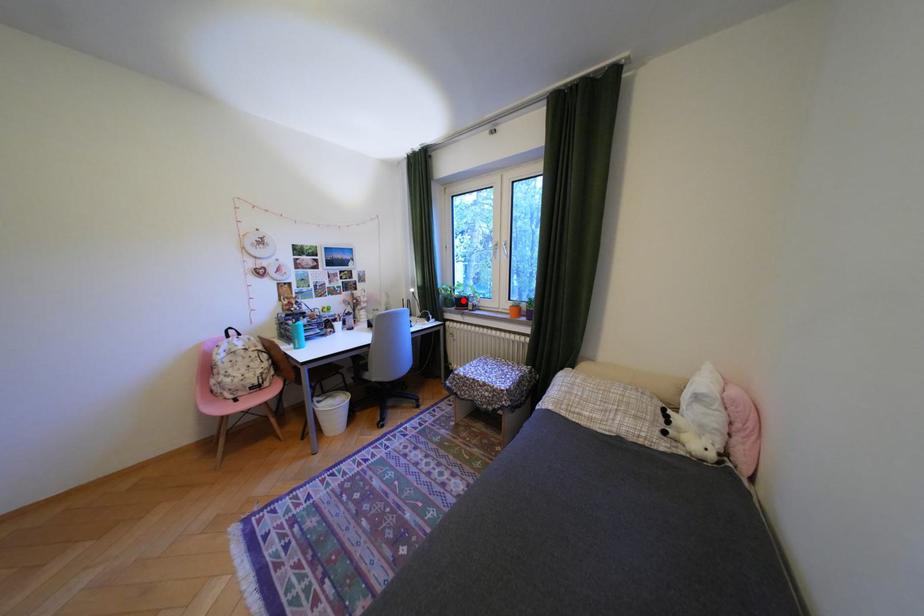
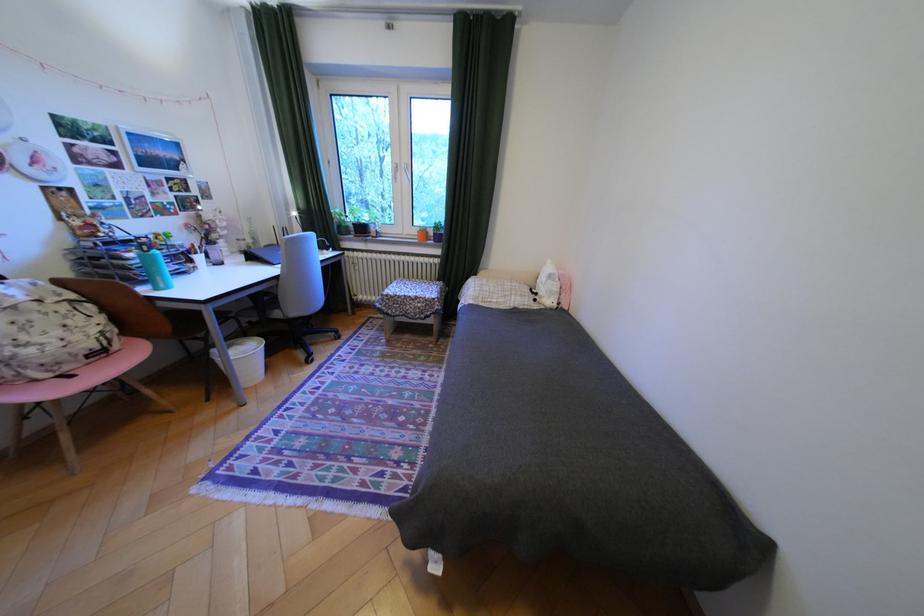
Question: I am providing you with two images of the same scene from different viewpoints. Given a red point in image1, look at the same physical point in image2. Is it:

Choices:
 (A) Closer to the viewpoint
 (B) Farther from the viewpoint

Answer: (A)